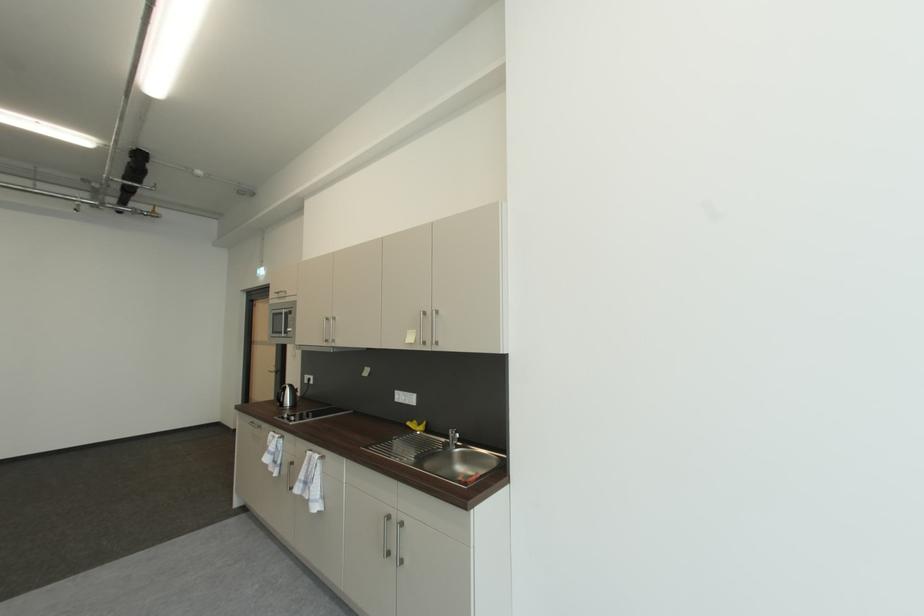
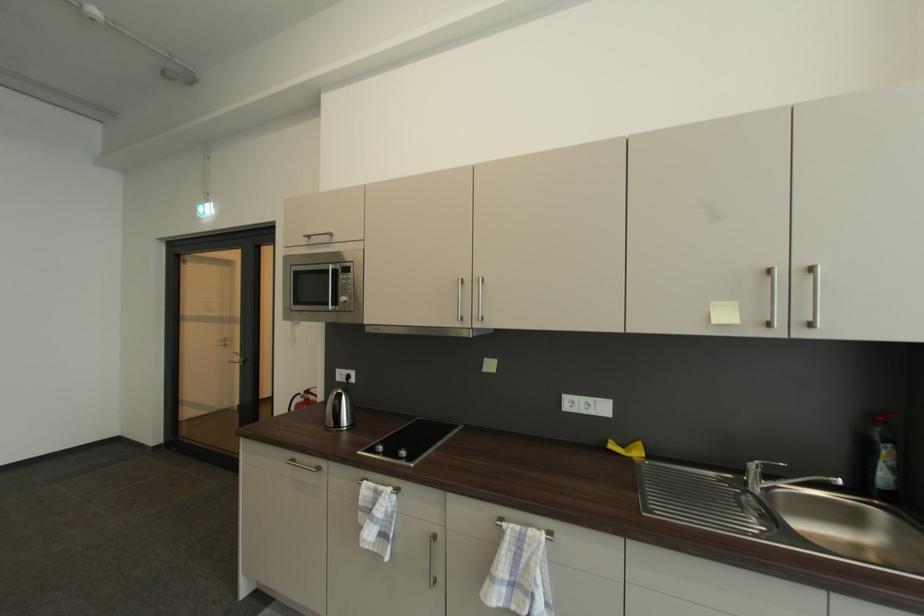
What movement of the cameraman would produce the second image?

The movement direction of the cameraman is left, forward.